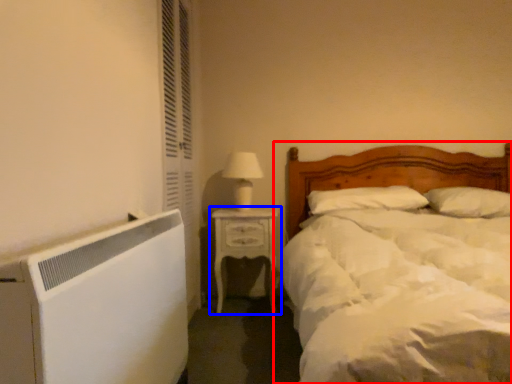
Question: Which object appears farthest to the camera in this image, bed (highlighted by a red box) or nightstand (highlighted by a blue box)?

Choices:
 (A) bed
 (B) nightstand

Answer: (B)